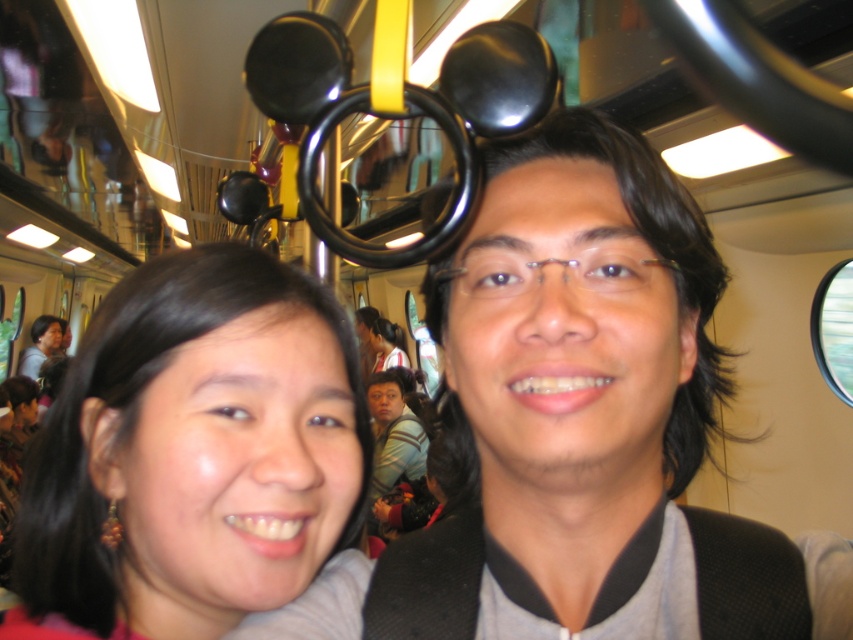
Question: Can you confirm if black fabric at center is positioned to the left of black hair at center?

Choices:
 (A) yes
 (B) no

Answer: (B)

Question: Is black hair at center in front of matte gray shirt at upper left?

Choices:
 (A) yes
 (B) no

Answer: (A)

Question: Among these objects, which one is nearest to the camera?

Choices:
 (A) matte gray shirt at upper left
 (B) black hair at center
 (C) black fabric at center

Answer: (C)

Question: Does black hair at center have a larger size compared to matte gray shirt at upper left?

Choices:
 (A) yes
 (B) no

Answer: (B)

Question: Which of these objects is positioned farthest from the matte gray shirt at upper left?

Choices:
 (A) black hair at center
 (B) black fabric at center

Answer: (B)

Question: Which object appears closest to the camera in this image?

Choices:
 (A) black fabric at center
 (B) matte gray shirt at upper left

Answer: (A)